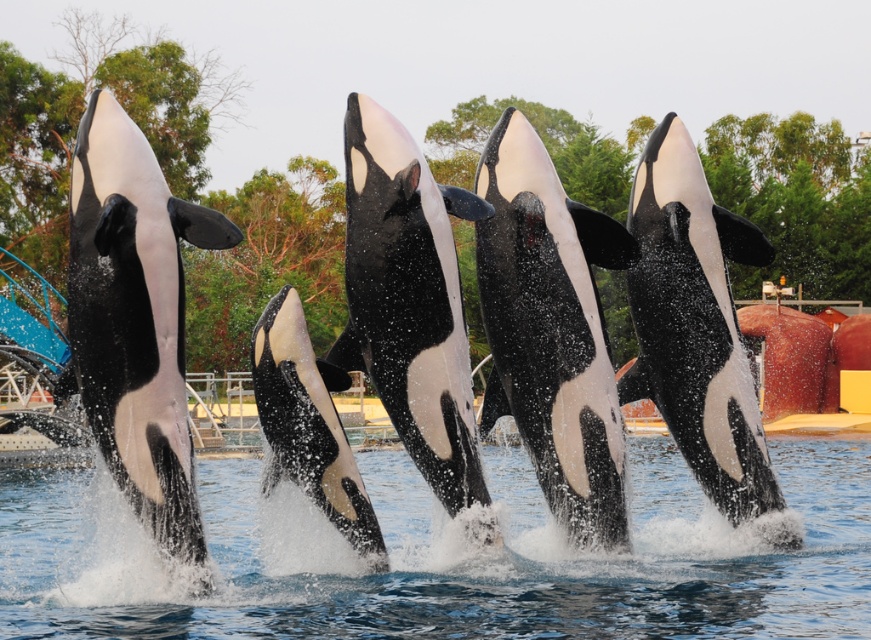
You are a marine biologist observing the orcas and dolphin in the image. Which of the two animals, the black and white orca at left or the black and white dolphin at center, has a smaller body width?

The black and white orca at left has a smaller body width compared to the black and white dolphin at center.

You are a marine biologist observing the orcas in the image. You notice a specific point marked at coordinates point (408, 300). Which orca is this point located on?

The point (408, 300) is on the black and white dolphin at center.